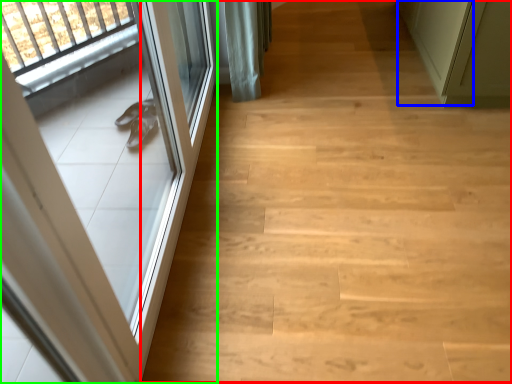
Question: Considering the real-world distances, which object is farthest from stairwell (highlighted by a red box)? door (highlighted by a blue box) or door (highlighted by a green box)?

Choices:
 (A) door
 (B) door

Answer: (A)